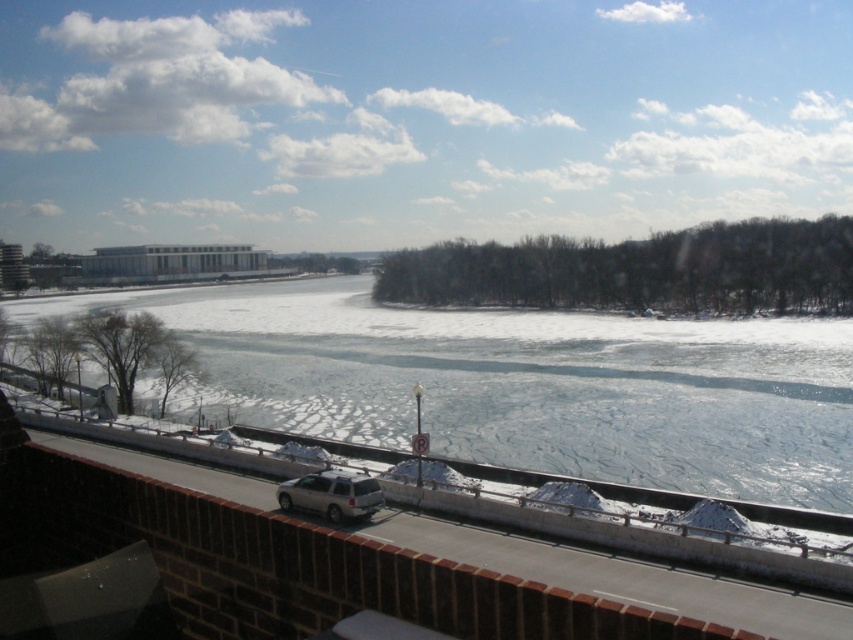
Is frozen ice at center wider than silver metallic suv at center?

Indeed, frozen ice at center has a greater width compared to silver metallic suv at center.

I want to click on frozen ice at center, so click(527, 384).